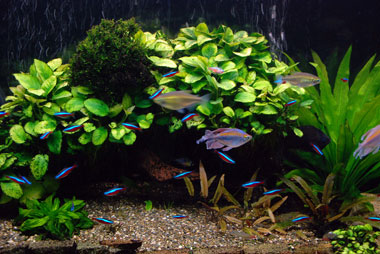
The image size is (380, 254). In order to click on floor in this screenshot , I will do `click(115, 226)`.